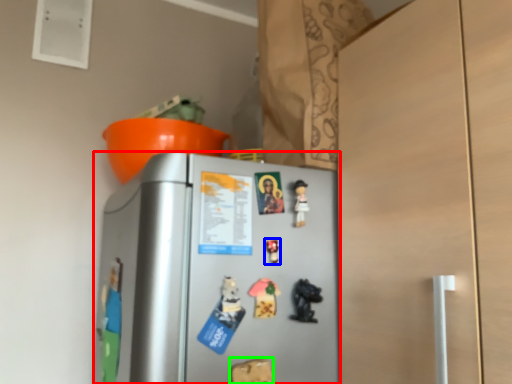
Question: Based on their relative distances, which object is farther from refrigerator (highlighted by a red box)? Choose from toy (highlighted by a blue box) and toy (highlighted by a green box).

Choices:
 (A) toy
 (B) toy

Answer: (B)